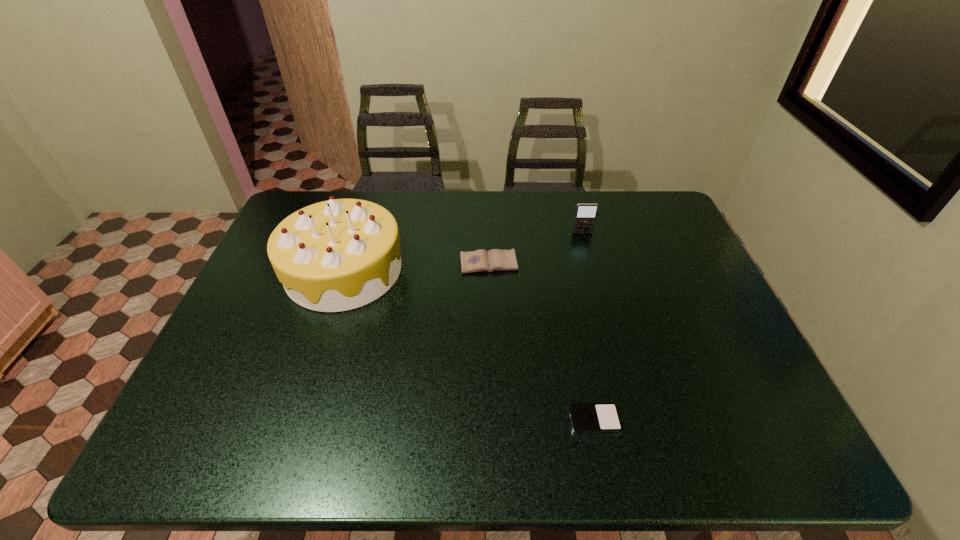
Locate an element on the screen. vacant area between the leftmost object and the diary is located at coordinates 417,267.

At what (x,y) coordinates should I click in order to perform the action: click on vacant space in between the leftmost object and the third object from right to left. Please return your answer as a coordinate pair (x, y). Image resolution: width=960 pixels, height=540 pixels. Looking at the image, I should click on (417, 267).

Where is `vacant area between the second tallest object and the leftmost object`? This screenshot has height=540, width=960. vacant area between the second tallest object and the leftmost object is located at coordinates (463, 252).

The image size is (960, 540). In order to click on free point between the second shortest object and the leftmost object in this screenshot , I will do `click(417, 267)`.

Find the location of a particular element. The image size is (960, 540). free space between the leftmost object and the nearer iPod is located at coordinates (469, 345).

This screenshot has width=960, height=540. Find the location of `free space between the leftmost object and the third object from right to left`. free space between the leftmost object and the third object from right to left is located at coordinates [417, 267].

At what (x,y) coordinates should I click in order to perform the action: click on empty location between the third shortest object and the second object from left to right. Please return your answer as a coordinate pair (x, y). This screenshot has height=540, width=960. Looking at the image, I should click on (536, 248).

Identify the location of free space between the taller iPod and the shorter iPod. This screenshot has width=960, height=540. (588, 326).

The height and width of the screenshot is (540, 960). Find the location of `free area in between the taller iPod and the birthday cake`. free area in between the taller iPod and the birthday cake is located at coordinates (463, 252).

Locate an element on the screen. Image resolution: width=960 pixels, height=540 pixels. vacant space that's between the taller iPod and the tallest object is located at coordinates (463, 252).